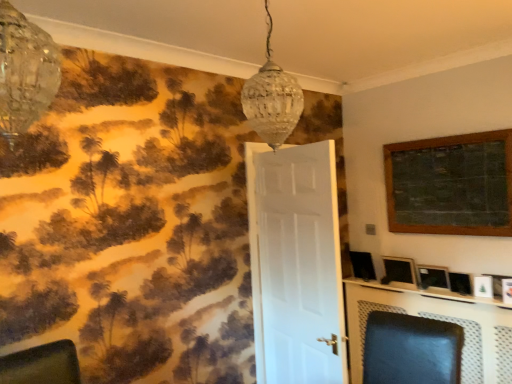
At what (x,y) coordinates should I click in order to perform the action: click on clear glass pendant light at upper center, the 2th lamp positioned from the front. Please return your answer as a coordinate pair (x, y). The height and width of the screenshot is (384, 512). Looking at the image, I should click on (272, 98).

Locate an element on the screen. The height and width of the screenshot is (384, 512). matte black swivel chair at center is located at coordinates (411, 350).

In order to face white matte door at center, should I rotate leftwards or rightwards?

To face it directly, rotate right by 5.298 degrees.

This screenshot has height=384, width=512. What do you see at coordinates (399, 272) in the screenshot? I see `matte black picture frame at right, the third picture frame in the bottom-to-top sequence` at bounding box center [399, 272].

Image resolution: width=512 pixels, height=384 pixels. I want to click on wooden framed chalkboard at upper right, the fourth picture frame from the bottom, so click(x=451, y=185).

Measure the distance between clear glass chandelier at upper left, placed as the 2th lamp when sorted from back to front, and camera.

clear glass chandelier at upper left, placed as the 2th lamp when sorted from back to front, and camera are 35.75 inches apart from each other.

What is the approximate width of clear glass chandelier at upper left, which is counted as the 2th lamp, starting from the right?

clear glass chandelier at upper left, which is counted as the 2th lamp, starting from the right, is 9.57 inches in width.

What do you see at coordinates (507, 290) in the screenshot?
I see `wooden picture frame at upper right, the 2th picture frame from the bottom` at bounding box center [507, 290].

Image resolution: width=512 pixels, height=384 pixels. I want to click on clear glass pendant light at upper center, arranged as the 2th lamp when viewed from the left, so click(272, 98).

How many degrees apart are the facing directions of white matte door at center and matte black picture frame at right, the first picture frame when ordered from bottom to top?

The angular difference between white matte door at center and matte black picture frame at right, the first picture frame when ordered from bottom to top, is 171 degrees.

Between white matte door at center and matte black picture frame at right, the first picture frame when ordered from bottom to top, which one appears on the right side from the viewer's perspective?

Positioned to the right is matte black picture frame at right, the first picture frame when ordered from bottom to top.

Considering their positions, is white matte door at center located in front of or behind matte black picture frame at right, the first picture frame when ordered from bottom to top?

Visually, white matte door at center is located in front of matte black picture frame at right, the first picture frame when ordered from bottom to top.

Considering the sizes of objects white matte door at center and matte black picture frame at right, the 4th picture frame positioned from the top, in the image provided, who is smaller, white matte door at center or matte black picture frame at right, the 4th picture frame positioned from the top,?

Smaller between the two is matte black picture frame at right, the 4th picture frame positioned from the top.

Is the surface of matte black swivel chair at center in direct contact with metallic silver tv at lower right?

No, matte black swivel chair at center is not beside metallic silver tv at lower right.

Who is taller, matte black swivel chair at center or metallic silver tv at lower right?

metallic silver tv at lower right is taller.

This screenshot has width=512, height=384. I want to click on table below the matte black swivel chair at center (from a real-world perspective), so click(436, 319).

What's the angular difference between matte black swivel chair at center and metallic silver tv at lower right's facing directions?

3.54 degrees.

Is matte black swivel chair at center facing towards matte black picture frame at right, acting as the second picture frame starting from the top?

No, matte black swivel chair at center is not facing towards matte black picture frame at right, acting as the second picture frame starting from the top.

In terms of size, does matte black swivel chair at center appear bigger or smaller than matte black picture frame at right, the third picture frame in the bottom-to-top sequence?

matte black swivel chair at center is bigger than matte black picture frame at right, the third picture frame in the bottom-to-top sequence.

From a real-world perspective, is matte black swivel chair at center under matte black picture frame at right, the third picture frame in the bottom-to-top sequence?

Correct, in the physical world, matte black swivel chair at center is lower than matte black picture frame at right, the third picture frame in the bottom-to-top sequence.

Is matte black swivel chair at center completely or partially outside of matte black picture frame at right, acting as the second picture frame starting from the top?

Yes, matte black swivel chair at center is outside of matte black picture frame at right, acting as the second picture frame starting from the top.

Does white matte door at center have a lesser width compared to matte black swivel chair at center?

Yes, white matte door at center is thinner than matte black swivel chair at center.

Could matte black swivel chair at center be considered to be inside white matte door at center?

Actually, matte black swivel chair at center is outside white matte door at center.

Are white matte door at center and matte black swivel chair at center beside each other?

white matte door at center and matte black swivel chair at center are not in contact.

Is matte black swivel chair at center at the back of white matte door at center?

white matte door at center is not turned away from matte black swivel chair at center.

Is matte black picture frame at right, acting as the second picture frame starting from the top, turned away from wooden picture frame at upper right, the 2th picture frame from the bottom?

No, matte black picture frame at right, acting as the second picture frame starting from the top,'s orientation is not away from wooden picture frame at upper right, the 2th picture frame from the bottom.

Can you confirm if matte black picture frame at right, the third picture frame in the bottom-to-top sequence, is thinner than wooden picture frame at upper right, marked as the third picture frame in a top-to-bottom arrangement?

Yes.

Is matte black picture frame at right, acting as the second picture frame starting from the top, situated inside wooden picture frame at upper right, marked as the third picture frame in a top-to-bottom arrangement, or outside?

matte black picture frame at right, acting as the second picture frame starting from the top, is outside wooden picture frame at upper right, marked as the third picture frame in a top-to-bottom arrangement.

From the image's perspective, is matte black picture frame at right, acting as the second picture frame starting from the top, positioned above or below wooden picture frame at upper right, marked as the third picture frame in a top-to-bottom arrangement?

matte black picture frame at right, acting as the second picture frame starting from the top, is above wooden picture frame at upper right, marked as the third picture frame in a top-to-bottom arrangement.

Can you confirm if clear glass pendant light at upper center, which appears as the first lamp when viewed from the back, is thinner than clear glass chandelier at upper left, placed as the 2th lamp when sorted from back to front?

Incorrect, the width of clear glass pendant light at upper center, which appears as the first lamp when viewed from the back, is not less than that of clear glass chandelier at upper left, placed as the 2th lamp when sorted from back to front.

Would you say clear glass pendant light at upper center, which appears as the first lamp when viewed from the back, contains clear glass chandelier at upper left, which is counted as the 2th lamp, starting from the right?

No, clear glass chandelier at upper left, which is counted as the 2th lamp, starting from the right, is located outside of clear glass pendant light at upper center, which appears as the first lamp when viewed from the back.

Between point (264, 102) and point (2, 1), which one is positioned behind?

Point (264, 102)

Is wooden picture frame at upper right, marked as the third picture frame in a top-to-bottom arrangement, facing towards clear glass chandelier at upper left, the first lamp from the left?

Yes.

Does point (509, 302) lie behind point (32, 64)?

Yes, it is.

Is wooden picture frame at upper right, marked as the third picture frame in a top-to-bottom arrangement, at the left side of clear glass chandelier at upper left, the first lamp from the left?

Incorrect, wooden picture frame at upper right, marked as the third picture frame in a top-to-bottom arrangement, is not on the left side of clear glass chandelier at upper left, the first lamp from the left.

From a real-world perspective, does wooden picture frame at upper right, marked as the third picture frame in a top-to-bottom arrangement, stand above clear glass chandelier at upper left, the first lamp from the left?

Actually, wooden picture frame at upper right, marked as the third picture frame in a top-to-bottom arrangement, is physically below clear glass chandelier at upper left, the first lamp from the left, in the real world.

I want to click on door to the left of matte black picture frame at right, the first picture frame when ordered from bottom to top, so (x=295, y=263).

Identify the location of swivel chair above the metallic silver tv at lower right (from the image's perspective). The height and width of the screenshot is (384, 512). (411, 350).

Considering their positions, is wooden framed chalkboard at upper right, the first picture frame in the top-to-bottom sequence, positioned closer to clear glass chandelier at upper left, placed as the 2th lamp when sorted from back to front, than matte black swivel chair at center?

matte black swivel chair at center.

Estimate the real-world distances between objects in this image. Which object is closer to matte black picture frame at right, the third picture frame in the bottom-to-top sequence, matte black swivel chair at center or wooden picture frame at upper right, marked as the third picture frame in a top-to-bottom arrangement?

wooden picture frame at upper right, marked as the third picture frame in a top-to-bottom arrangement, is positioned closer to the anchor matte black picture frame at right, the third picture frame in the bottom-to-top sequence.

Looking at the image, which one is located closer to clear glass pendant light at upper center, arranged as the 2th lamp when viewed from the left, matte black swivel chair at center or matte black picture frame at right, the third picture frame in the bottom-to-top sequence?

matte black swivel chair at center is positioned closer to the anchor clear glass pendant light at upper center, arranged as the 2th lamp when viewed from the left.

Looking at the image, which one is located further to clear glass chandelier at upper left, positioned as the first lamp in front-to-back order, white matte door at center or matte black picture frame at right, the 4th picture frame positioned from the top?

matte black picture frame at right, the 4th picture frame positioned from the top.

Based on their spatial positions, is white matte door at center or matte black picture frame at right, the third picture frame in the bottom-to-top sequence, closer to wooden picture frame at upper right, the 2th picture frame from the bottom?

Among the two, matte black picture frame at right, the third picture frame in the bottom-to-top sequence, is located nearer to wooden picture frame at upper right, the 2th picture frame from the bottom.

When comparing their distances from matte black picture frame at right, acting as the second picture frame starting from the top, does white matte door at center or wooden picture frame at upper right, the 2th picture frame from the bottom, seem further?

white matte door at center is further to matte black picture frame at right, acting as the second picture frame starting from the top.

From the image, which object appears to be farther from matte black picture frame at right, the first picture frame when ordered from bottom to top, clear glass chandelier at upper left, placed as the 2th lamp when sorted from back to front, or wooden picture frame at upper right, marked as the third picture frame in a top-to-bottom arrangement?

clear glass chandelier at upper left, placed as the 2th lamp when sorted from back to front.

When comparing their distances from clear glass pendant light at upper center, which appears as the first lamp when viewed from the back, does matte black picture frame at right, acting as the second picture frame starting from the top, or clear glass chandelier at upper left, positioned as the first lamp in front-to-back order, seem further?

Based on the image, matte black picture frame at right, acting as the second picture frame starting from the top, appears to be further to clear glass pendant light at upper center, which appears as the first lamp when viewed from the back.

The width and height of the screenshot is (512, 384). Identify the location of table located between white matte door at center and matte black picture frame at right, the 4th picture frame positioned from the top, in the left-right direction. (436, 319).

Where is `picture frame between white matte door at center and metallic silver tv at lower right`? picture frame between white matte door at center and metallic silver tv at lower right is located at coordinates (399, 272).

You are a GUI agent. You are given a task and a screenshot of the screen. Output one action in this format:
    pyautogui.click(x=<x>, y=<y>)
    Task: Click on the door between clear glass chandelier at upper left, placed as the 2th lamp when sorted from back to front, and wooden picture frame at upper right, marked as the third picture frame in a top-to-bottom arrangement, from left to right
    
    Given the screenshot: What is the action you would take?
    pyautogui.click(x=295, y=263)

Identify the location of swivel chair positioned between clear glass chandelier at upper left, positioned as the first lamp in front-to-back order, and metallic silver tv at lower right from near to far. (411, 350).